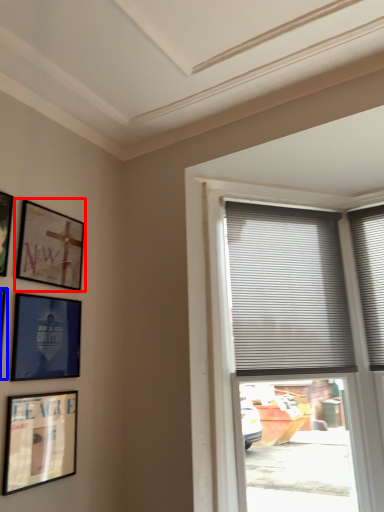
Question: Which object appears farthest to the camera in this image, picture frame (highlighted by a red box) or picture frame (highlighted by a blue box)?

Choices:
 (A) picture frame
 (B) picture frame

Answer: (A)